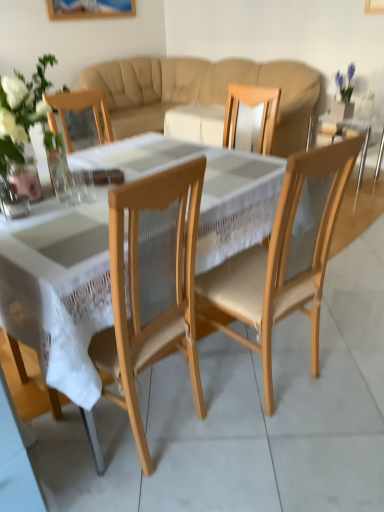
What are the coordinates of `free space in front of clear glass vase at left` in the screenshot? It's located at (33, 217).